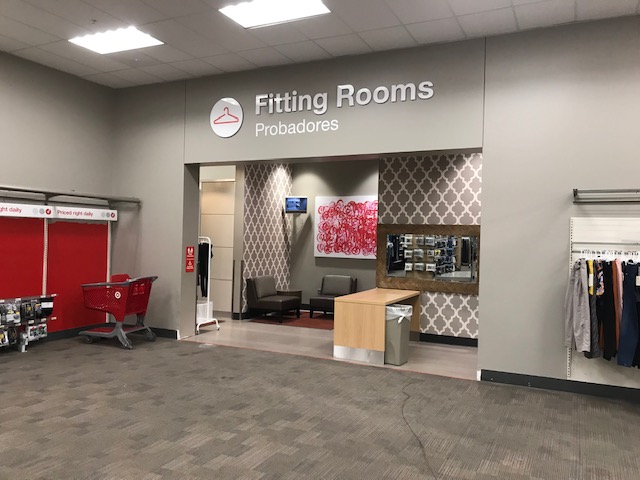
The image size is (640, 480). What are the coordinates of `chair` in the screenshot? It's located at (260, 299), (323, 299).